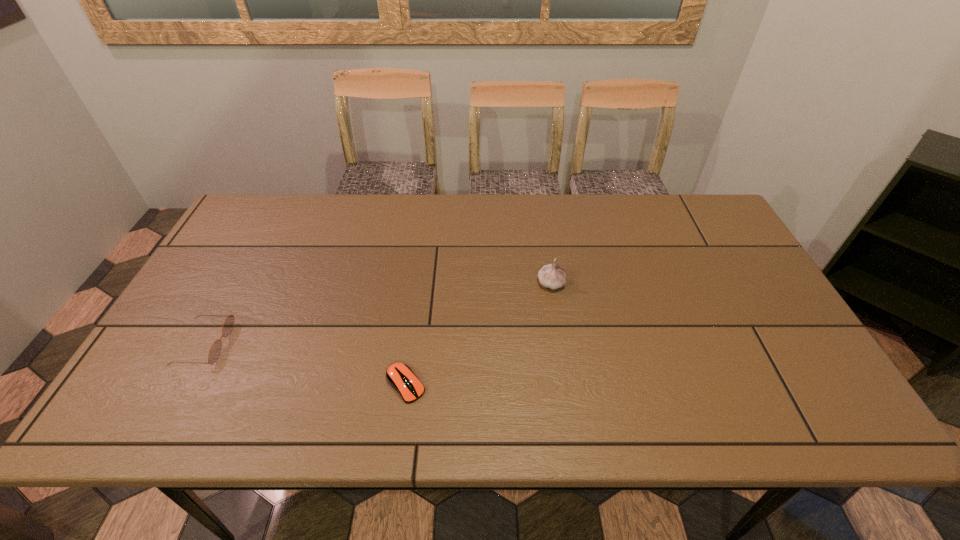
The height and width of the screenshot is (540, 960). I want to click on the tallest object, so click(x=552, y=276).

You are a GUI agent. You are given a task and a screenshot of the screen. Output one action in this format:
    pyautogui.click(x=<x>, y=<y>)
    Task: Click on the garlic
    This screenshot has width=960, height=540.
    Given the screenshot: What is the action you would take?
    [x=552, y=276]

Locate an element on the screen. Image resolution: width=960 pixels, height=540 pixels. the leftmost object is located at coordinates (215, 349).

Where is `sunglasses`? The height and width of the screenshot is (540, 960). sunglasses is located at coordinates (215, 349).

Find the location of `computer mouse`. computer mouse is located at coordinates (399, 375).

Find the location of `the second object from left to right`. the second object from left to right is located at coordinates (399, 375).

I want to click on free space located on the left of the garlic, so click(447, 284).

Where is `free space located on the face of the leftmost object`? Image resolution: width=960 pixels, height=540 pixels. free space located on the face of the leftmost object is located at coordinates (271, 343).

At what (x,y) coordinates should I click in order to perform the action: click on free location located on the left of the shortest object. Please return your answer as a coordinate pair (x, y). Looking at the image, I should click on pyautogui.click(x=221, y=384).

Find the location of a particular element. Image resolution: width=960 pixels, height=540 pixels. object located at the near edge is located at coordinates (399, 375).